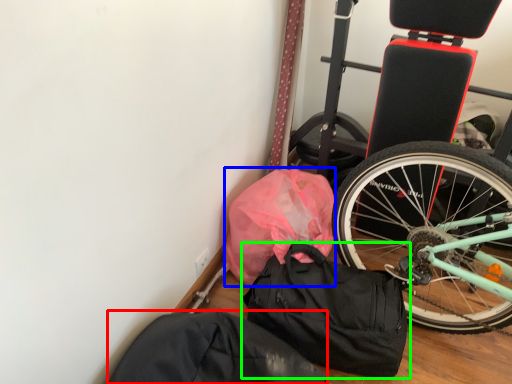
Question: Which object is positioned farthest from sack (highlighted by a red box)? Select from material (highlighted by a blue box) and luggage and bags (highlighted by a green box).

Choices:
 (A) material
 (B) luggage and bags

Answer: (A)